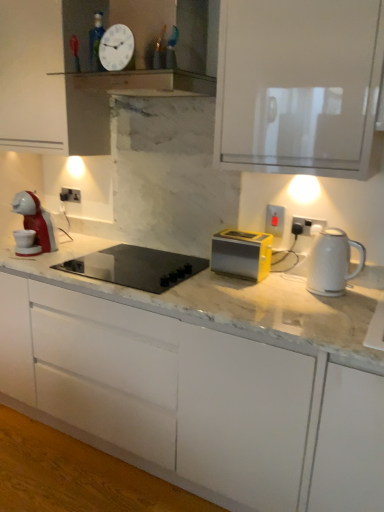
You are a GUI agent. You are given a task and a screenshot of the screen. Output one action in this format:
    pyautogui.click(x=<x>, y=<y>)
    Task: Click on the vacant area on the back side of white glossy clock at upper center
    The width and height of the screenshot is (384, 512).
    Given the screenshot: What is the action you would take?
    tap(117, 81)